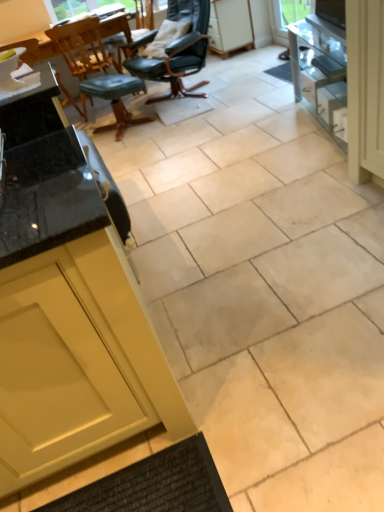
The width and height of the screenshot is (384, 512). In order to click on vacant area that is in front of leather-like black chair at upper center, positioned as the 1th chair in right-to-left order in this screenshot , I will do `click(192, 118)`.